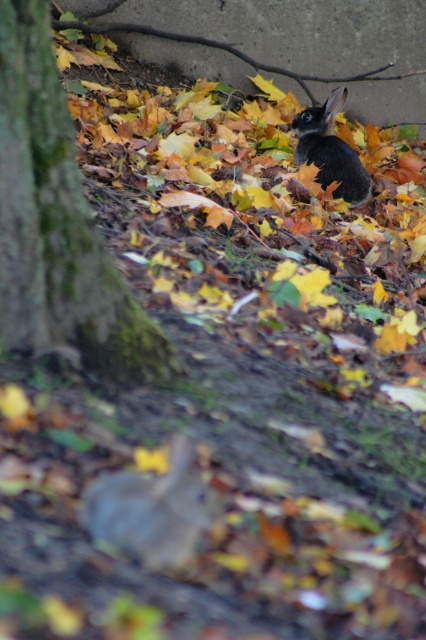
Question: Is fuzzy gray rabbit at lower center smaller than black fur rabbit at center?

Choices:
 (A) no
 (B) yes

Answer: (B)

Question: Can you confirm if fuzzy gray rabbit at lower center is positioned to the right of black fur rabbit at center?

Choices:
 (A) no
 (B) yes

Answer: (A)

Question: Among these points, which one is nearest to the camera?

Choices:
 (A) (170, 522)
 (B) (5, 148)

Answer: (A)

Question: Estimate the real-world distances between objects in this image. Which object is closer to the green mossy tree trunk at left?

Choices:
 (A) fuzzy gray rabbit at lower center
 (B) black fur rabbit at center

Answer: (A)

Question: Can you confirm if fuzzy gray rabbit at lower center is bigger than black fur rabbit at center?

Choices:
 (A) yes
 (B) no

Answer: (B)

Question: Among these objects, which one is farthest from the camera?

Choices:
 (A) fuzzy gray rabbit at lower center
 (B) black fur rabbit at center

Answer: (B)